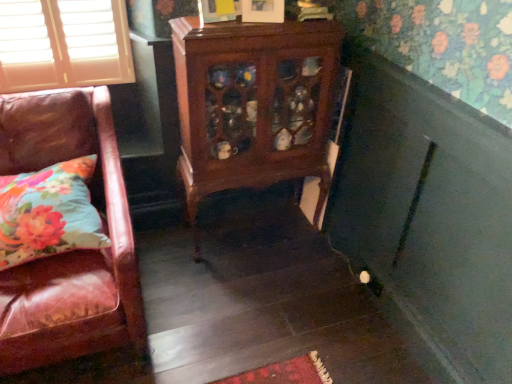
Question: Based on their positions, is floral fabric pillow at lower left located to the left or right of mahogany cabinet at center?

Choices:
 (A) right
 (B) left

Answer: (B)

Question: In the image, is floral fabric pillow at lower left positioned in front of or behind mahogany cabinet at center?

Choices:
 (A) front
 (B) behind

Answer: (A)

Question: In terms of height, does floral fabric pillow at lower left look taller or shorter compared to mahogany cabinet at center?

Choices:
 (A) short
 (B) tall

Answer: (A)

Question: From their relative heights in the image, would you say mahogany cabinet at center is taller or shorter than floral fabric pillow at lower left?

Choices:
 (A) tall
 (B) short

Answer: (A)

Question: Based on their positions, is mahogany cabinet at center located to the left or right of floral fabric pillow at lower left?

Choices:
 (A) left
 (B) right

Answer: (B)

Question: Which is correct: mahogany cabinet at center is inside floral fabric pillow at lower left, or outside of it?

Choices:
 (A) inside
 (B) outside

Answer: (B)

Question: In the image, is mahogany cabinet at center positioned in front of or behind floral fabric pillow at lower left?

Choices:
 (A) front
 (B) behind

Answer: (B)